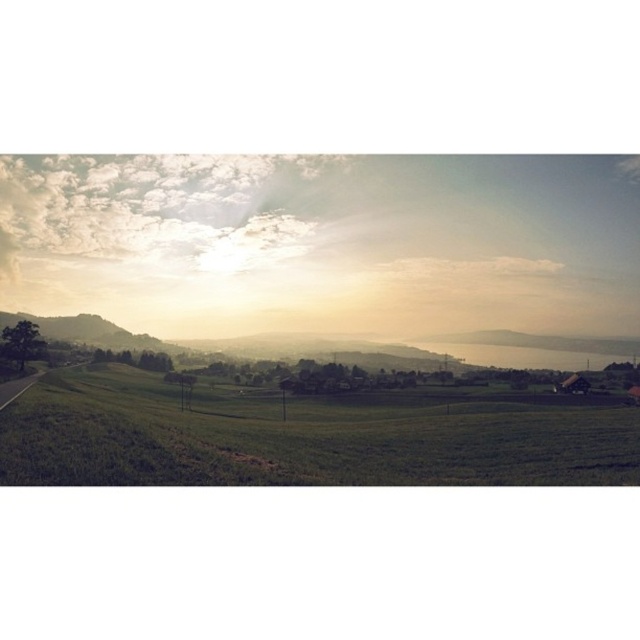
Question: Is green grassy field at lower left in front of golden haze landscape at center?

Choices:
 (A) no
 (B) yes

Answer: (B)

Question: Can you confirm if green grassy field at lower left is thinner than golden haze landscape at center?

Choices:
 (A) no
 (B) yes

Answer: (B)

Question: Does green grassy field at lower left appear over golden haze landscape at center?

Choices:
 (A) yes
 (B) no

Answer: (B)

Question: Which object is closer to the camera taking this photo?

Choices:
 (A) golden haze landscape at center
 (B) green grassy field at lower left

Answer: (B)

Question: Which object is closer to the camera taking this photo?

Choices:
 (A) golden haze landscape at center
 (B) green grassy field at lower left

Answer: (B)

Question: Which of the following is the closest to the observer?

Choices:
 (A) (250, 356)
 (B) (147, 458)

Answer: (B)